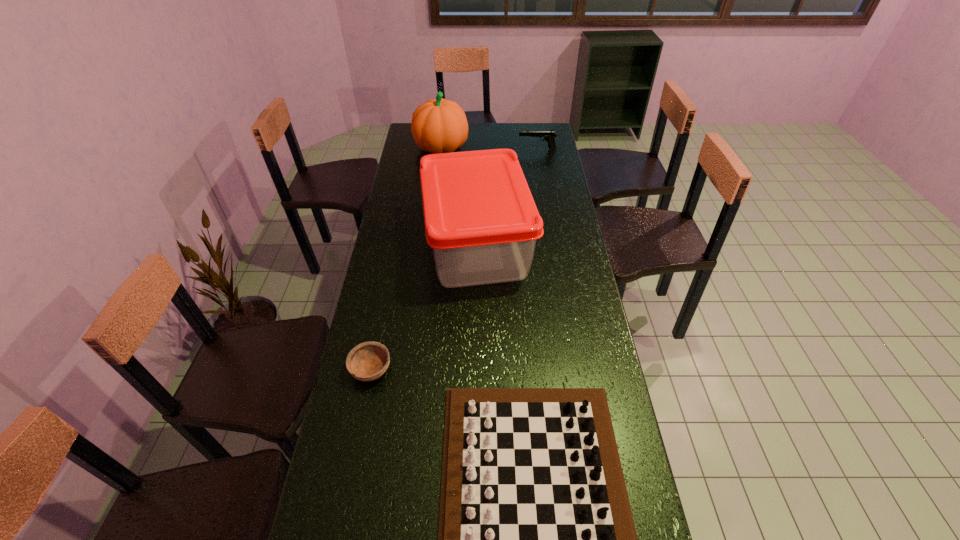
In order to click on free space between the fourth farthest object and the pumpkin in this screenshot , I will do `click(406, 258)`.

Find the location of `the fourth closest object to the third farthest object`. the fourth closest object to the third farthest object is located at coordinates (549, 136).

The width and height of the screenshot is (960, 540). In order to click on object that is the fourth closest one to the pumpkin in this screenshot , I will do `click(536, 539)`.